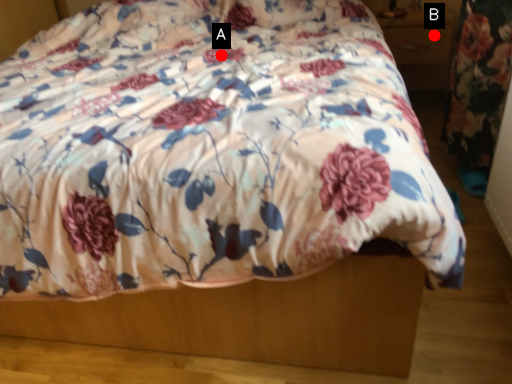
Question: Two points are circled on the image, labeled by A and B beside each circle. Among these points, which one is nearest to the camera?

Choices:
 (A) A is closer
 (B) B is closer

Answer: (A)